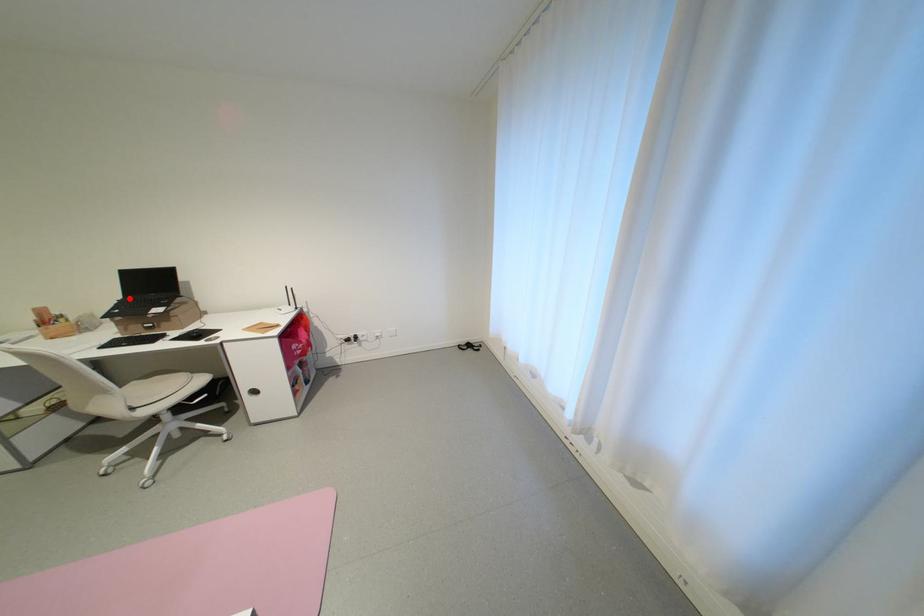
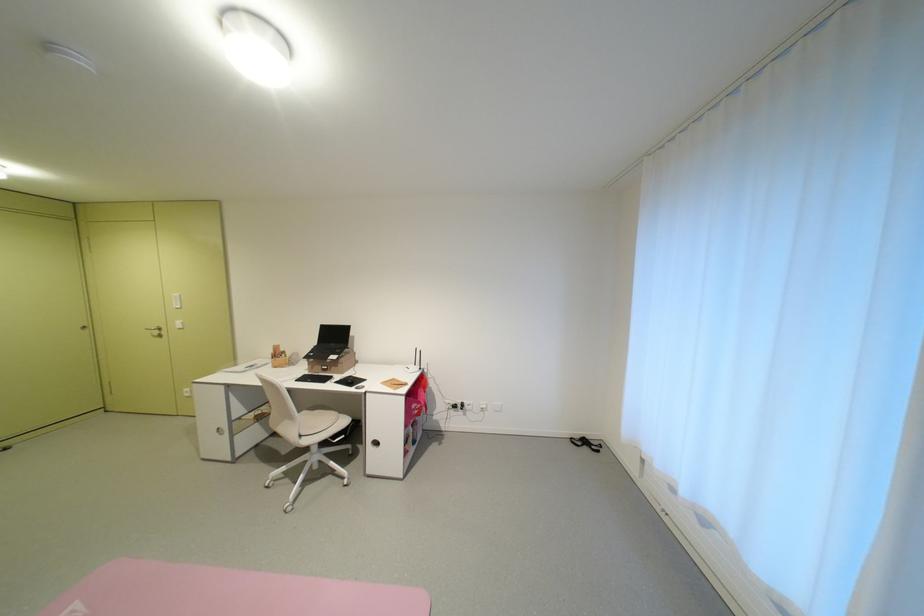
The point at the highlighted location is marked in the first image. Where is the corresponding point in the second image?

(324, 345)